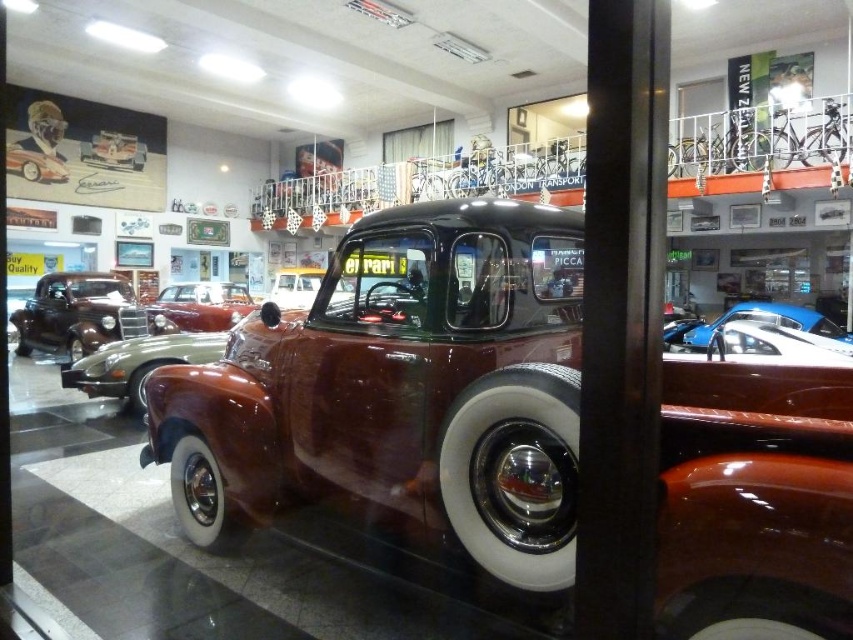
Who is higher up, shiny maroon car at center or shiny silver car at center?

shiny maroon car at center is higher up.

Does point (245, 291) come in front of point (338, 298)?

No, (245, 291) is further to viewer.

The image size is (853, 640). Identify the location of shiny maroon car at center. (200, 307).

From the picture: Does shiny silver car at center have a smaller size compared to shiny silver car at upper left?

No.

Is point (315, 272) closer to viewer compared to point (59, 168)?

That is False.

Who is more forward, (312, 268) or (39, 179)?

Point (39, 179)

At what (x,y) coordinates should I click in order to perform the action: click on shiny silver car at center. Please return your answer as a coordinate pair (x, y). Looking at the image, I should click on (294, 285).

Does point (44, 323) come in front of point (218, 330)?

No, (44, 323) is further to viewer.

Can you confirm if shiny brown car at left is shorter than shiny maroon car at center?

No, shiny brown car at left is not shorter than shiny maroon car at center.

In the scene shown: Who is more distant from viewer, (132, 320) or (189, 324)?

Point (189, 324)

Find the location of `shiny brown car at left`. shiny brown car at left is located at coordinates (77, 314).